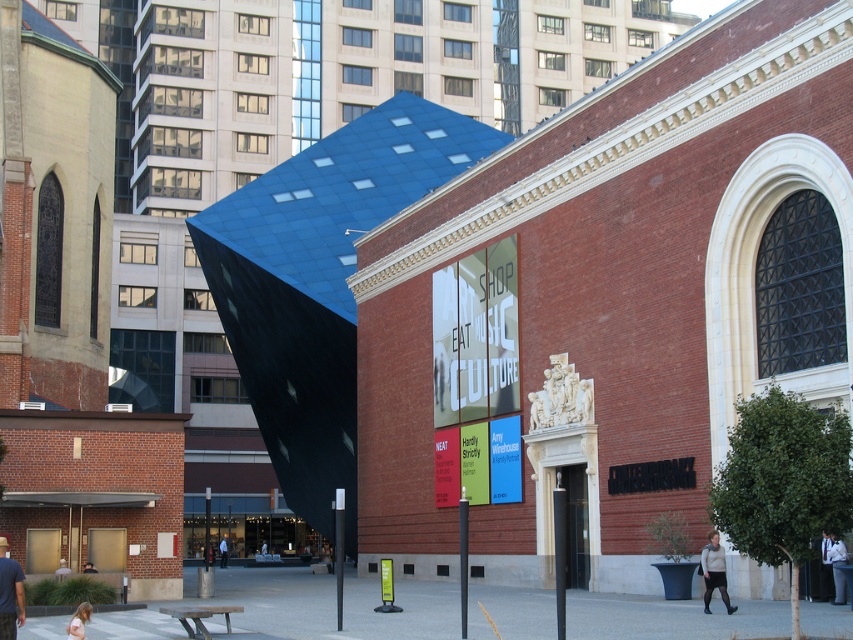
Question: Which point is closer to the camera?

Choices:
 (A) blonde hair at lower left
 (B) dark blue fabric at center

Answer: (A)

Question: Is white shirt at lower right smaller than blonde hair at lower left?

Choices:
 (A) yes
 (B) no

Answer: (A)

Question: Is white shirt at lower right to the left of blonde hair at lower left from the viewer's perspective?

Choices:
 (A) no
 (B) yes

Answer: (A)

Question: Can you confirm if white shirt at lower right is smaller than blonde hair at lower left?

Choices:
 (A) no
 (B) yes

Answer: (B)

Question: Which point appears farthest from the camera in this image?

Choices:
 (A) (223, 547)
 (B) (712, 564)

Answer: (A)

Question: Among these points, which one is farthest from the camera?

Choices:
 (A) (57, 566)
 (B) (824, 570)
 (C) (86, 564)

Answer: (A)